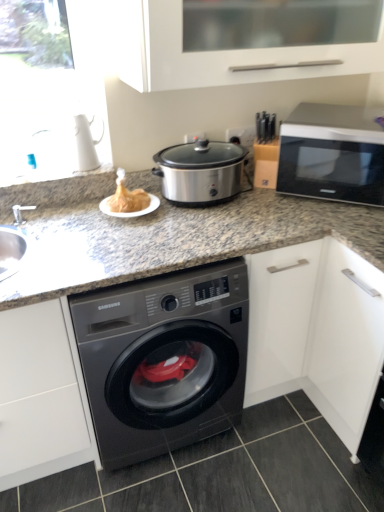
Question: From the image's perspective, is black glossy washing machine at center on dark gray tile at lower center?

Choices:
 (A) no
 (B) yes

Answer: (B)

Question: Does black glossy washing machine at center lie in front of dark gray tile at lower center?

Choices:
 (A) yes
 (B) no

Answer: (A)

Question: Is black glossy washing machine at center positioned behind dark gray tile at lower center?

Choices:
 (A) no
 (B) yes

Answer: (A)

Question: Is black glossy washing machine at center shorter than dark gray tile at lower center?

Choices:
 (A) yes
 (B) no

Answer: (B)

Question: Is black glossy washing machine at center next to dark gray tile at lower center and touching it?

Choices:
 (A) no
 (B) yes

Answer: (A)

Question: Would you consider black glossy washing machine at center to be distant from dark gray tile at lower center?

Choices:
 (A) yes
 (B) no

Answer: (B)

Question: Is silver metallic microwave at upper right outside golden crispy turkey at center?

Choices:
 (A) no
 (B) yes

Answer: (B)

Question: Is silver metallic microwave at upper right at the left side of golden crispy turkey at center?

Choices:
 (A) no
 (B) yes

Answer: (A)

Question: Does silver metallic microwave at upper right touch golden crispy turkey at center?

Choices:
 (A) yes
 (B) no

Answer: (B)

Question: Is there a large distance between silver metallic microwave at upper right and golden crispy turkey at center?

Choices:
 (A) no
 (B) yes

Answer: (A)

Question: Does silver metallic microwave at upper right lie behind golden crispy turkey at center?

Choices:
 (A) no
 (B) yes

Answer: (A)

Question: Does silver metallic microwave at upper right appear on the right side of golden crispy turkey at center?

Choices:
 (A) yes
 (B) no

Answer: (A)

Question: Are white matte cabinet at upper center and black glossy washing machine at center far apart?

Choices:
 (A) no
 (B) yes

Answer: (A)